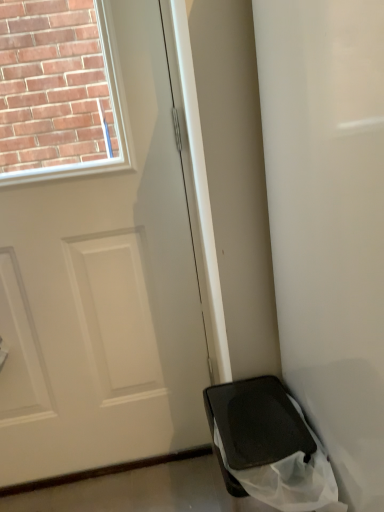
Question: From a real-world perspective, is black matte bag at lower right under black matte trash can at lower right?

Choices:
 (A) no
 (B) yes

Answer: (A)

Question: Does black matte bag at lower right appear on the left side of black matte trash can at lower right?

Choices:
 (A) no
 (B) yes

Answer: (A)

Question: Does black matte bag at lower right have a greater height compared to black matte trash can at lower right?

Choices:
 (A) yes
 (B) no

Answer: (A)

Question: Can you confirm if black matte bag at lower right is shorter than black matte trash can at lower right?

Choices:
 (A) yes
 (B) no

Answer: (B)

Question: Is black matte bag at lower right at the right side of black matte trash can at lower right?

Choices:
 (A) yes
 (B) no

Answer: (A)

Question: From the image's perspective, is black matte bag at lower right positioned above or below black matte trash can at lower right?

Choices:
 (A) below
 (B) above

Answer: (B)

Question: From a real-world perspective, is black matte bag at lower right physically located above or below black matte trash can at lower right?

Choices:
 (A) above
 (B) below

Answer: (A)

Question: Considering the positions of black matte bag at lower right and black matte trash can at lower right in the image, is black matte bag at lower right taller or shorter than black matte trash can at lower right?

Choices:
 (A) tall
 (B) short

Answer: (A)

Question: Is black matte bag at lower right bigger or smaller than black matte trash can at lower right?

Choices:
 (A) big
 (B) small

Answer: (A)

Question: From a real-world perspective, relative to black matte bag at lower right, is white matte door at center vertically above or below?

Choices:
 (A) below
 (B) above

Answer: (B)

Question: Is white matte door at center bigger or smaller than black matte bag at lower right?

Choices:
 (A) big
 (B) small

Answer: (B)

Question: From the image's perspective, is white matte door at center located above or below black matte bag at lower right?

Choices:
 (A) above
 (B) below

Answer: (A)

Question: From their relative heights in the image, would you say white matte door at center is taller or shorter than black matte bag at lower right?

Choices:
 (A) short
 (B) tall

Answer: (B)

Question: Considering the positions of point (296, 362) and point (102, 326), is point (296, 362) closer or farther from the camera than point (102, 326)?

Choices:
 (A) farther
 (B) closer

Answer: (B)

Question: Considering the relative positions of black matte bag at lower right and white matte door at center in the image provided, is black matte bag at lower right to the left or to the right of white matte door at center?

Choices:
 (A) left
 (B) right

Answer: (B)